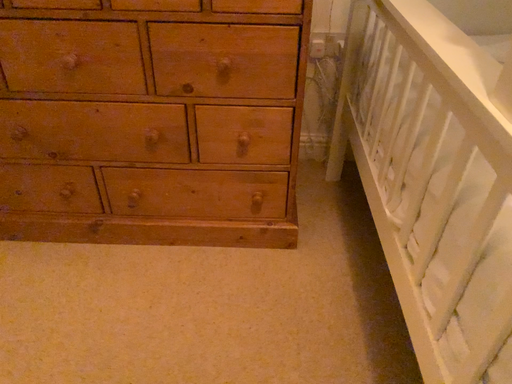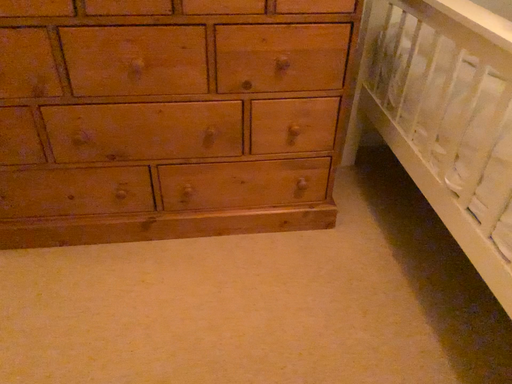
Question: How did the camera likely rotate when shooting the video?

Choices:
 (A) rotated left
 (B) rotated right

Answer: (B)